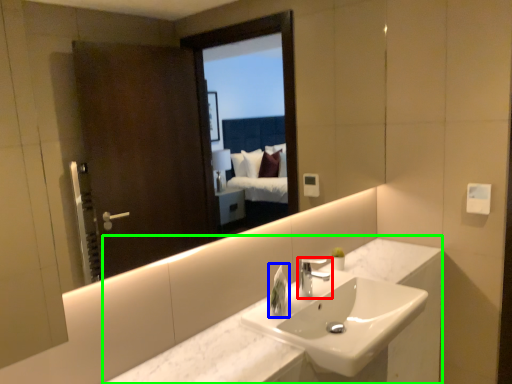
Question: Estimate the real-world distances between objects in this image. Which object is closer to tap (highlighted by a red box), soap dispenser (highlighted by a blue box) or counter (highlighted by a green box)?

Choices:
 (A) soap dispenser
 (B) counter

Answer: (A)